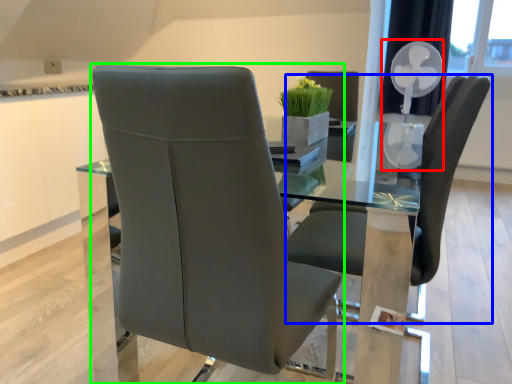
Question: Which object is the closest to the fan (highlighted by a red box)? Choose among these: chair (highlighted by a blue box) or chair (highlighted by a green box).

Choices:
 (A) chair
 (B) chair

Answer: (A)